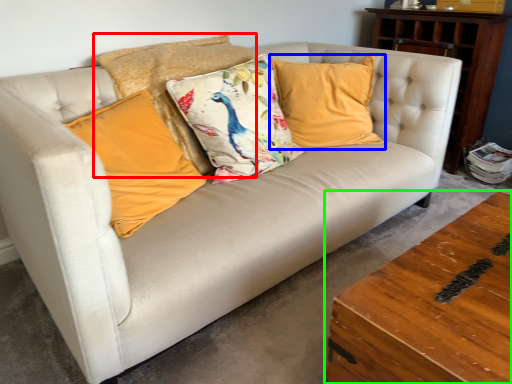
Question: Considering the real-world distances, which object is closest to pillow (highlighted by a red box)? pillow (highlighted by a blue box) or table (highlighted by a green box).

Choices:
 (A) pillow
 (B) table

Answer: (A)